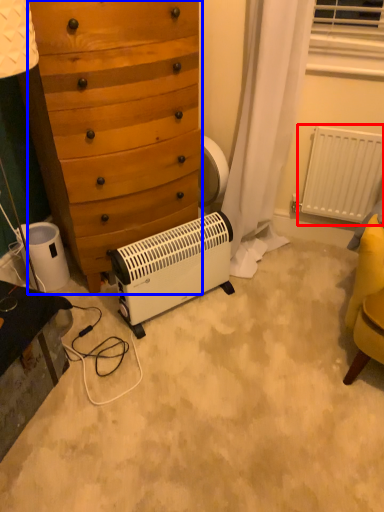
Question: Which object appears farthest to the camera in this image, radiator (highlighted by a red box) or chest of drawers (highlighted by a blue box)?

Choices:
 (A) radiator
 (B) chest of drawers

Answer: (A)